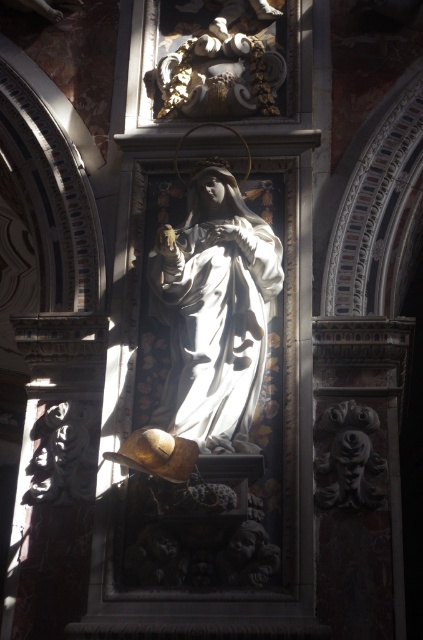
Does point (222, 182) come in front of point (349, 451)?

That is False.

Does matte white statue at center appear under carved stone face at lower right?

Incorrect, matte white statue at center is not positioned below carved stone face at lower right.

Between point (186, 406) and point (362, 432), which one is positioned in front?

Positioned in front is point (186, 406).

Locate an element on the screen. matte white statue at center is located at coordinates (214, 310).

Is the position of matte white statue at center more distant than that of gold textured statue at upper center?

No, matte white statue at center is in front of gold textured statue at upper center.

You are a GUI agent. You are given a task and a screenshot of the screen. Output one action in this format:
    pyautogui.click(x=<x>, y=<y>)
    Task: Click on the matte white statue at center
    The image size is (423, 640).
    Given the screenshot: What is the action you would take?
    pyautogui.click(x=214, y=310)

Locate an element on the screen. Image resolution: width=423 pixels, height=640 pixels. matte white statue at center is located at coordinates (214, 310).

Between gold textured statue at upper center and carved stone face at lower right, which one has more height?

gold textured statue at upper center

Is point (170, 83) in front of point (331, 465)?

No, (170, 83) is further to viewer.

At what (x,y) coordinates should I click in order to perform the action: click on gold textured statue at upper center. Please return your answer as a coordinate pair (x, y). This screenshot has width=423, height=640. Looking at the image, I should click on (219, 61).